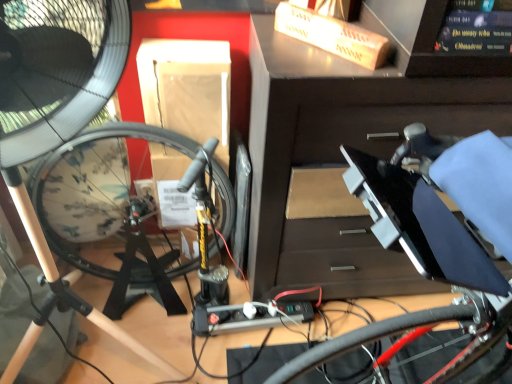
Question: From a real-world perspective, is black glossy book at upper right positioned under black matte fan at left based on gravity?

Choices:
 (A) yes
 (B) no

Answer: (B)

Question: Is black glossy book at upper right at the right side of black matte fan at left?

Choices:
 (A) yes
 (B) no

Answer: (A)

Question: Is black glossy book at upper right to the left of black matte fan at left from the viewer's perspective?

Choices:
 (A) yes
 (B) no

Answer: (B)

Question: Can you confirm if black glossy book at upper right is thinner than black matte fan at left?

Choices:
 (A) no
 (B) yes

Answer: (A)

Question: Considering the relative sizes of black glossy book at upper right and black matte fan at left in the image provided, is black glossy book at upper right smaller than black matte fan at left?

Choices:
 (A) yes
 (B) no

Answer: (A)

Question: From the image's perspective, does black glossy book at upper right appear higher than black matte fan at left?

Choices:
 (A) no
 (B) yes

Answer: (B)

Question: Considering the relative positions of black matte fan at left and black glossy book at upper right in the image provided, is black matte fan at left to the left of black glossy book at upper right from the viewer's perspective?

Choices:
 (A) yes
 (B) no

Answer: (A)

Question: Does black matte fan at left have a larger size compared to black glossy book at upper right?

Choices:
 (A) yes
 (B) no

Answer: (A)

Question: Does black matte fan at left have a greater height compared to black glossy book at upper right?

Choices:
 (A) yes
 (B) no

Answer: (A)

Question: Is black matte fan at left shorter than black glossy book at upper right?

Choices:
 (A) yes
 (B) no

Answer: (B)

Question: Would you consider black matte fan at left to be distant from black glossy book at upper right?

Choices:
 (A) yes
 (B) no

Answer: (B)

Question: Is black glossy book at upper right at the back of black matte fan at left?

Choices:
 (A) yes
 (B) no

Answer: (B)

Question: From the image's perspective, is shiny red bicycle wheel at lower right over black plastic workbench at center?

Choices:
 (A) yes
 (B) no

Answer: (B)